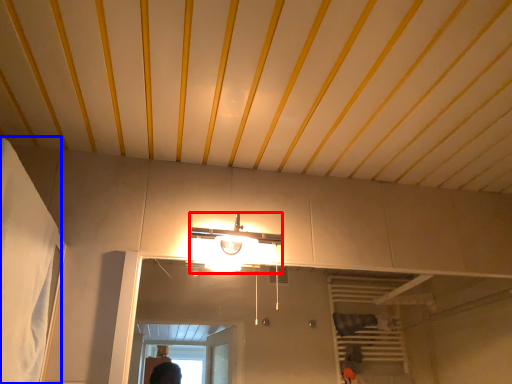
Question: Which object appears closest to the camera in this image, light fixture (highlighted by a red box) or curtain (highlighted by a blue box)?

Choices:
 (A) light fixture
 (B) curtain

Answer: (B)